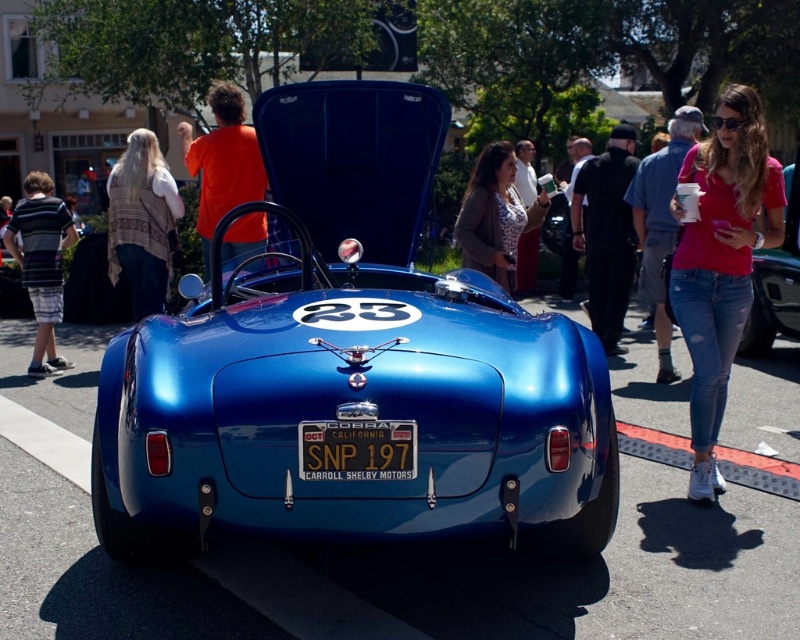
Is point (22, 230) closer to camera compared to point (408, 464)?

No.

Who is more forward, (5, 237) or (404, 420)?

Point (404, 420) is more forward.

Between point (58, 356) and point (412, 445), which one is positioned behind?

Positioned behind is point (58, 356).

Locate an element on the screen. The width and height of the screenshot is (800, 640). striped fabric shorts at left is located at coordinates (41, 262).

Can you confirm if black leather jacket at center is positioned below metallic blue car at center?

→ Actually, black leather jacket at center is above metallic blue car at center.

Can you confirm if black leather jacket at center is positioned to the left of metallic blue car at center?

Correct, you'll find black leather jacket at center to the left of metallic blue car at center.

Does point (601, 192) come farther from viewer compared to point (784, 282)?

Yes, point (601, 192) is behind point (784, 282).

Find the location of a particular element. The height and width of the screenshot is (640, 800). black leather jacket at center is located at coordinates (606, 234).

Is point (494, 230) positioned before point (796, 262)?

Yes, it is in front of point (796, 262).

Is matte brown jacket at center to the right of metallic blue car at center from the viewer's perspective?

No, matte brown jacket at center is not to the right of metallic blue car at center.

Which is behind, point (486, 161) or point (788, 291)?

Point (788, 291)

Identify the location of matte brown jacket at center. This screenshot has width=800, height=640. (496, 216).